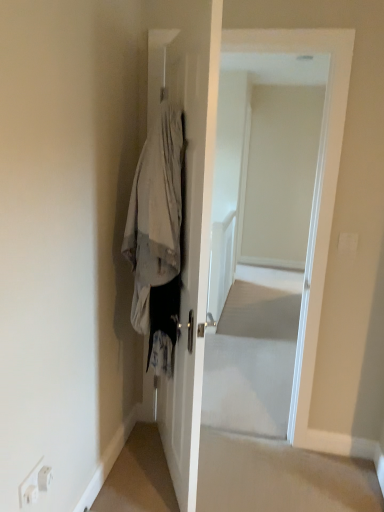
Locate an element on the screen. vacant space underneath denim jacket at center (from a real-world perspective) is located at coordinates point(151,477).